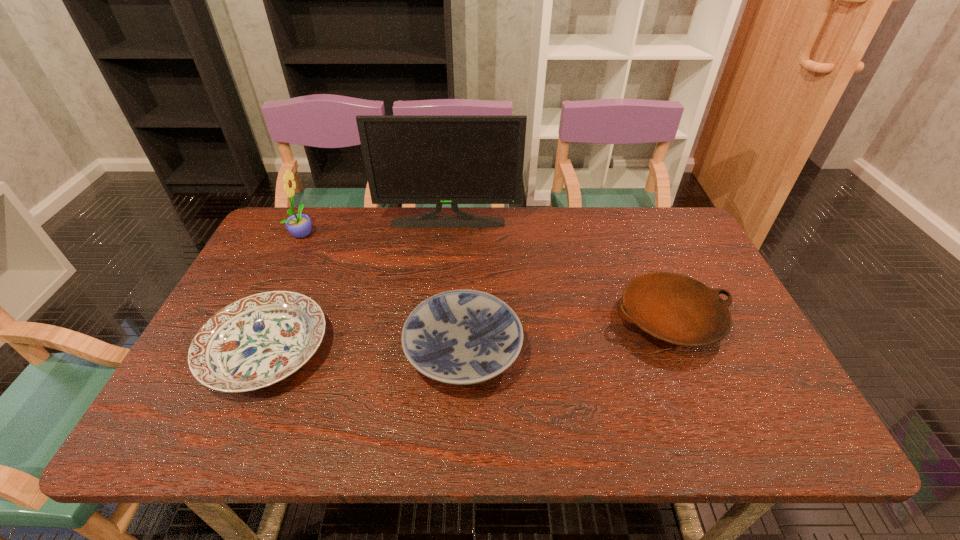
Locate an element on the screen. free space located 0.390m on the right of the leftmost plate is located at coordinates (490, 350).

You are a GUI agent. You are given a task and a screenshot of the screen. Output one action in this format:
    pyautogui.click(x=<x>, y=<y>)
    Task: Click on the monitor located at the far edge
    This screenshot has width=960, height=540.
    Given the screenshot: What is the action you would take?
    (454, 160)

The width and height of the screenshot is (960, 540). I want to click on sunflower at the far edge, so click(x=299, y=225).

Locate an element on the screen. This screenshot has width=960, height=540. sunflower that is at the left edge is located at coordinates (299, 225).

The width and height of the screenshot is (960, 540). Identify the location of plate that is at the left edge. (259, 340).

What are the coordinates of `object that is at the right edge` in the screenshot? It's located at (674, 308).

Locate an element on the screen. The height and width of the screenshot is (540, 960). object that is positioned at the far left corner is located at coordinates (299, 225).

In the image, there is a desktop. Where is `vacant space at the far edge`? vacant space at the far edge is located at coordinates (536, 243).

Locate an element on the screen. The image size is (960, 540). free spot at the near edge of the desktop is located at coordinates (275, 421).

Image resolution: width=960 pixels, height=540 pixels. I want to click on blank space at the far left corner of the desktop, so click(278, 251).